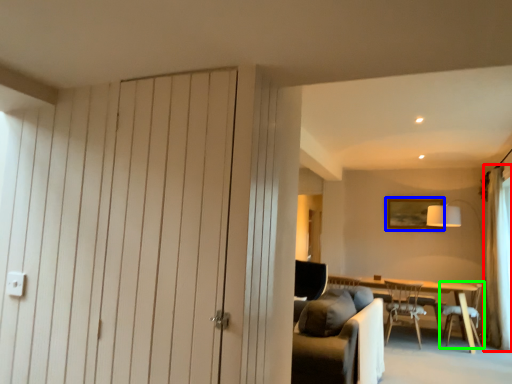
Question: Estimate the real-world distances between objects in this image. Which object is closer to curtain (highlighted by a red box), picture frame (highlighted by a blue box) or chair (highlighted by a green box)?

Choices:
 (A) picture frame
 (B) chair

Answer: (B)